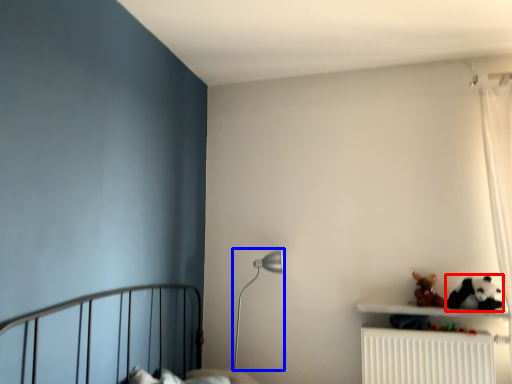
Question: Which point is closer to the camera, animal (highlighted by a red box) or table lamp (highlighted by a blue box)?

Choices:
 (A) animal
 (B) table lamp

Answer: (A)